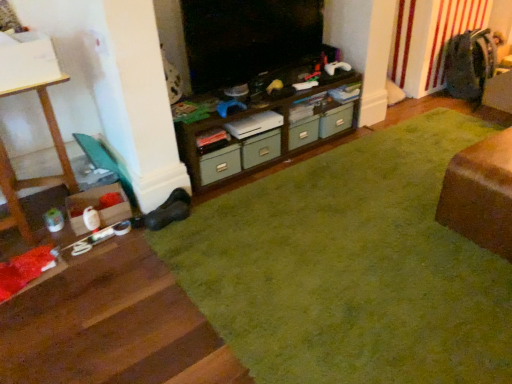
Question: Should I look upward or downward to see green fabric drawer at center, the first drawer positioned from the front?

Choices:
 (A) up
 (B) down

Answer: (A)

Question: Can you confirm if brown wood cabinet at center is bigger than green matte drawer at center, the first drawer viewed from the back?

Choices:
 (A) yes
 (B) no

Answer: (A)

Question: Could green matte drawer at center, placed as the 1th drawer when sorted from right to left, be considered to be inside brown wood cabinet at center?

Choices:
 (A) yes
 (B) no

Answer: (A)

Question: Is brown wood cabinet at center positioned with its back to green matte drawer at center, the second drawer positioned from the left?

Choices:
 (A) no
 (B) yes

Answer: (B)

Question: Can you confirm if brown wood cabinet at center is smaller than green matte drawer at center, which is the 2th drawer in front-to-back order?

Choices:
 (A) no
 (B) yes

Answer: (A)

Question: From the image's perspective, is brown wood cabinet at center on green matte drawer at center, the second drawer positioned from the left?

Choices:
 (A) yes
 (B) no

Answer: (B)

Question: From the image's perspective, does brown wood cabinet at center appear lower than green matte drawer at center, the first drawer viewed from the back?

Choices:
 (A) no
 (B) yes

Answer: (B)

Question: Does green carpet at center lie in front of green matte drawer at center, the second drawer positioned from the left?

Choices:
 (A) no
 (B) yes

Answer: (B)

Question: Would you consider green carpet at center to be distant from green matte drawer at center, the second drawer positioned from the left?

Choices:
 (A) no
 (B) yes

Answer: (A)

Question: Is green carpet at center wider than green matte drawer at center, placed as the 1th drawer when sorted from right to left?

Choices:
 (A) yes
 (B) no

Answer: (A)

Question: Can you confirm if green carpet at center is taller than green matte drawer at center, which is the 2th drawer in front-to-back order?

Choices:
 (A) yes
 (B) no

Answer: (B)

Question: Is green carpet at center outside of green matte drawer at center, which is the 2th drawer in front-to-back order?

Choices:
 (A) yes
 (B) no

Answer: (A)

Question: Is green carpet at center in contact with green matte drawer at center, placed as the 1th drawer when sorted from right to left?

Choices:
 (A) no
 (B) yes

Answer: (A)

Question: Is green matte drawer at center, the first drawer viewed from the back, wider than green carpet at center?

Choices:
 (A) yes
 (B) no

Answer: (B)